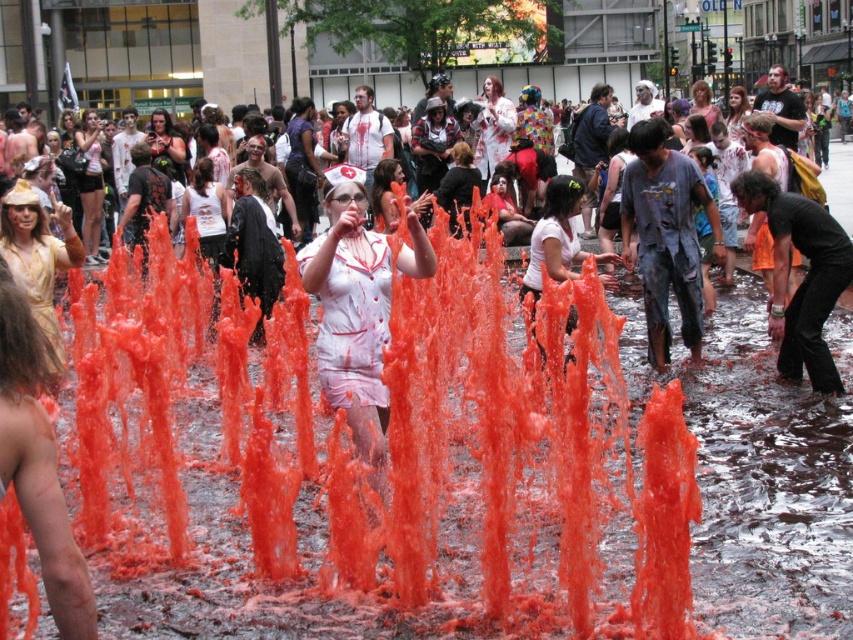
You are a costume designer observing the scene and need to determine which nurse costume is wider. You see the white matte nurse outfit at center and the white matte nurse uniform at center. Which one has a greater width?

The white matte nurse uniform at center has a greater width than the white matte nurse outfit at center.

You are a photographer trying to capture the nurse in the center of the scene. The nurse is wearing a matte white nurse hat at center and has blonde hair at center. Which part of the nurse is more prominent in the photo?

The blonde hair at center is more prominent because the matte white nurse hat at center occupies less space than blonde hair at center.

You are standing in the crowd at the lively event and want to move closer to both the bright orange fountain and the nurse in the red cross uniform. Which of the two points, point (846,403) or point (82,147), is closer to you and would allow you to reach the fountain first?

Point (846,403) is closer to the viewer than point (82,147), so you would reach the fountain first by moving towards point (846,403).